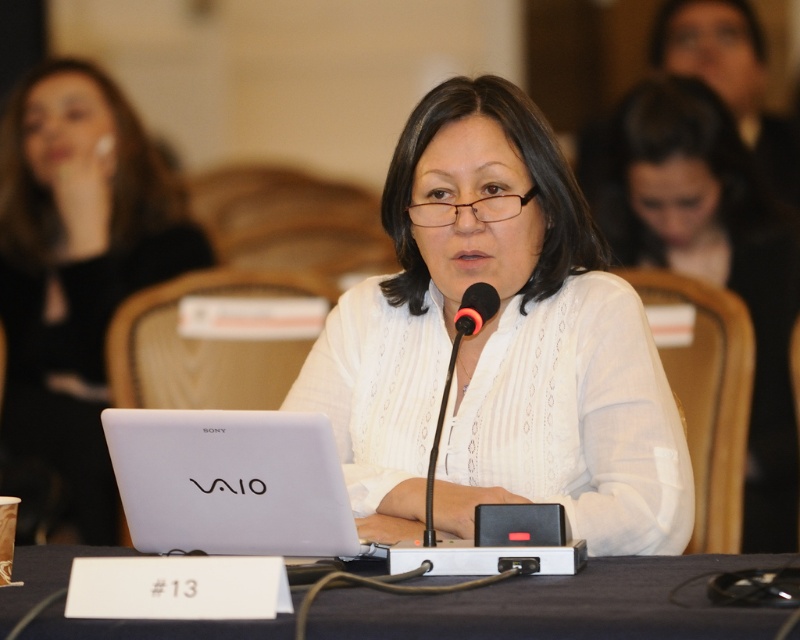
Which is more to the left, white fabric shirt at center or black matte microphone at center?

From the viewer's perspective, black matte microphone at center appears more on the left side.

Can you confirm if white fabric shirt at center is smaller than black matte microphone at center?

Incorrect, white fabric shirt at center is not smaller in size than black matte microphone at center.

Does point (760, 260) lie in front of point (488, 291)?

No, (760, 260) is further to viewer.

Where is `white fabric shirt at center`? This screenshot has height=640, width=800. white fabric shirt at center is located at coordinates (709, 253).

Can you confirm if white matte laptop at center is bigger than black matte microphone at center?

Actually, white matte laptop at center might be smaller than black matte microphone at center.

Can you confirm if white matte laptop at center is wider than black matte microphone at center?

Yes, white matte laptop at center is wider than black matte microphone at center.

Locate an element on the screen. The width and height of the screenshot is (800, 640). white matte laptop at center is located at coordinates (232, 483).

Identify the location of white matte laptop at center. (232, 483).

Can you confirm if black plastic table at center is bigger than black matte microphone at center?

Yes.

Who is lower down, black plastic table at center or black matte microphone at center?

Positioned lower is black plastic table at center.

Is point (625, 612) behind point (428, 541)?

No, it is in front of (428, 541).

Locate an element on the screen. The image size is (800, 640). black plastic table at center is located at coordinates (562, 604).